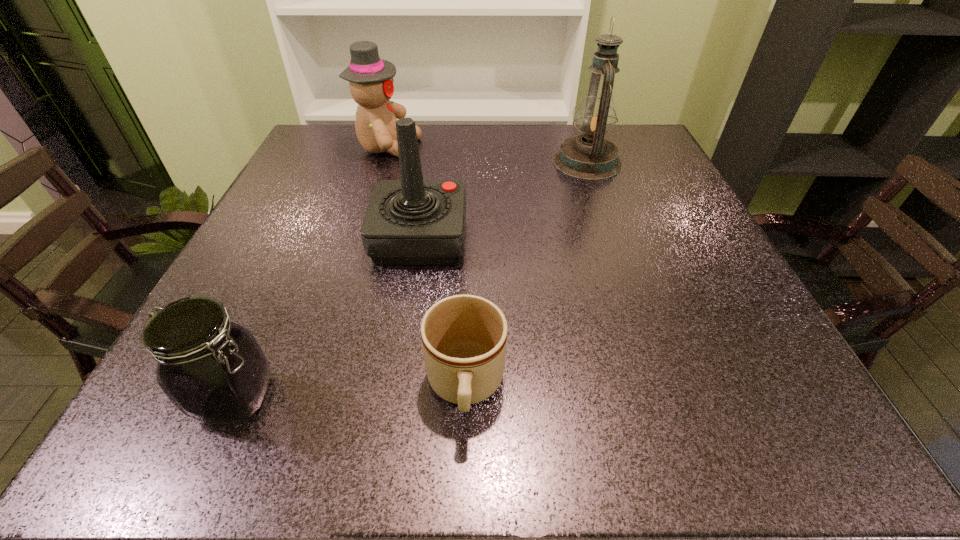
Find the location of a particular element. free space at the far edge of the desktop is located at coordinates point(448,154).

Where is `vacant space at the near edge of the desktop`? The height and width of the screenshot is (540, 960). vacant space at the near edge of the desktop is located at coordinates (354, 392).

The height and width of the screenshot is (540, 960). In order to click on free space at the left edge of the desktop in this screenshot , I will do `click(285, 329)`.

Identify the location of free space at the far left corner of the desktop. The width and height of the screenshot is (960, 540). (354, 138).

At what (x,y) coordinates should I click in order to perform the action: click on vacant space at the near left corner of the desktop. Please return your answer as a coordinate pair (x, y). This screenshot has width=960, height=540. Looking at the image, I should click on (186, 424).

Locate an element on the screen. free space at the far right corner of the desktop is located at coordinates (636, 130).

Find the location of a particular element. The height and width of the screenshot is (540, 960). free space at the near right corner of the desktop is located at coordinates (703, 421).

Locate an element on the screen. The width and height of the screenshot is (960, 540). free space between the tallest object and the jar is located at coordinates (412, 280).

You are a GUI agent. You are given a task and a screenshot of the screen. Output one action in this format:
    pyautogui.click(x=<x>, y=<y>)
    Task: Click on the vacant region between the second shortest object and the rightmost object
    This screenshot has width=960, height=540.
    Given the screenshot: What is the action you would take?
    pyautogui.click(x=412, y=280)

This screenshot has height=540, width=960. Find the location of `free area in between the jar and the tallest object`. free area in between the jar and the tallest object is located at coordinates (412, 280).